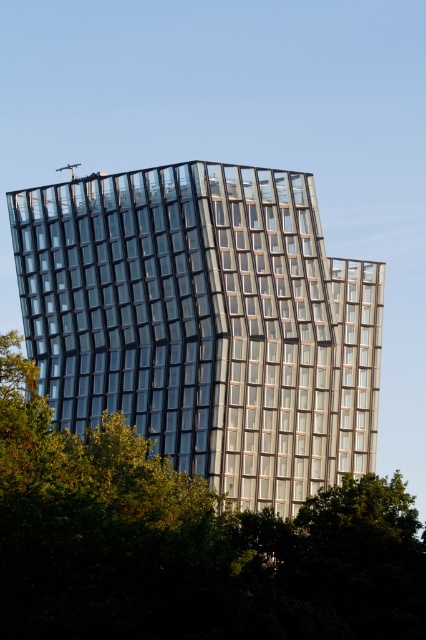
Question: Which point is closer to the camera?

Choices:
 (A) green leafy tree at center
 (B) glassy metallic building at center

Answer: (A)

Question: Does glassy metallic building at center have a smaller size compared to green leafy tree at center?

Choices:
 (A) no
 (B) yes

Answer: (A)

Question: Is the position of glassy metallic building at center more distant than that of green leafy tree at center?

Choices:
 (A) no
 (B) yes

Answer: (B)

Question: Does glassy metallic building at center appear on the right side of green leafy tree at center?

Choices:
 (A) yes
 (B) no

Answer: (B)

Question: Which object appears closest to the camera in this image?

Choices:
 (A) glassy metallic building at center
 (B) green leafy tree at center

Answer: (B)